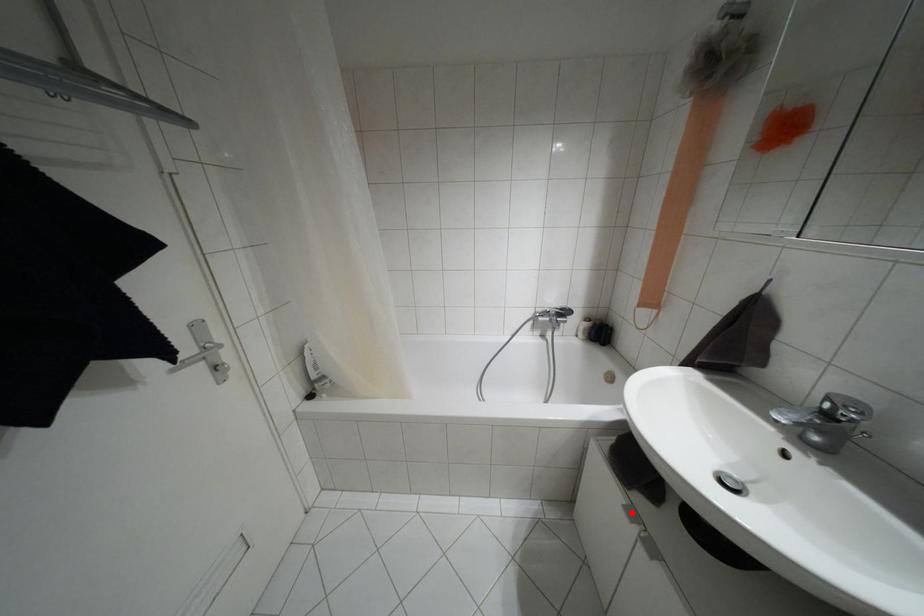
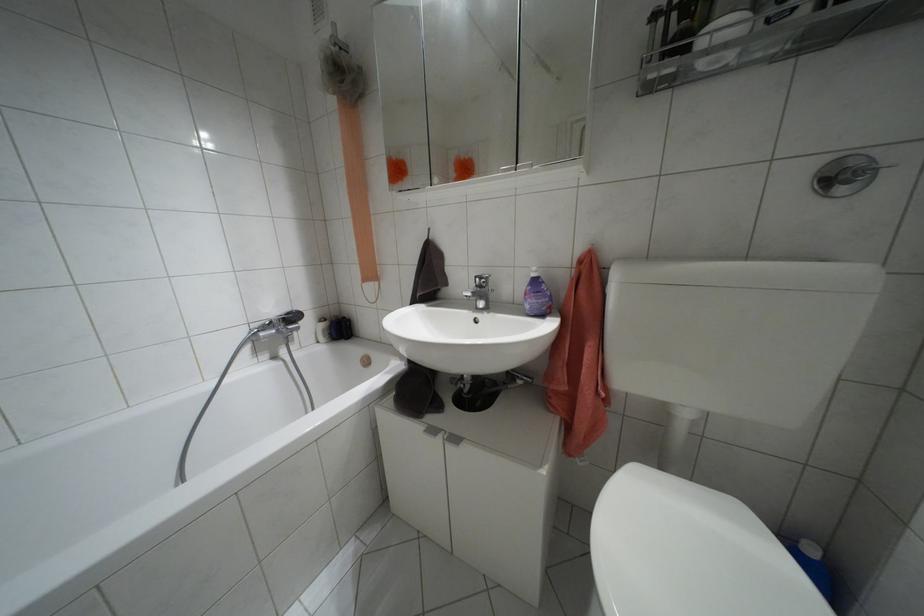
Where in the second image is the point corresponding to the highlighted location from the first image?

(432, 430)